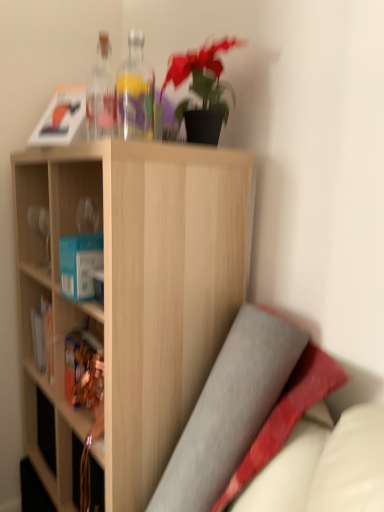
Question: From a real-world perspective, is transparent glass bottles at upper center, which is counted as the first bottle, starting from the left, positioned under light wood shelf at center based on gravity?

Choices:
 (A) yes
 (B) no

Answer: (B)

Question: Is transparent glass bottles at upper center, which is counted as the first bottle, starting from the left, to the left of light wood shelf at center from the viewer's perspective?

Choices:
 (A) no
 (B) yes

Answer: (A)

Question: Does transparent glass bottles at upper center, which is counted as the first bottle, starting from the left, have a larger size compared to light wood shelf at center?

Choices:
 (A) yes
 (B) no

Answer: (B)

Question: Does transparent glass bottles at upper center, the 2th bottle from the right, have a smaller size compared to light wood shelf at center?

Choices:
 (A) yes
 (B) no

Answer: (A)

Question: From the image's perspective, is transparent glass bottles at upper center, which is counted as the first bottle, starting from the left, beneath light wood shelf at center?

Choices:
 (A) yes
 (B) no

Answer: (B)

Question: Is there a large distance between transparent glass bottles at upper center, the 2th bottle from the right, and light wood shelf at center?

Choices:
 (A) yes
 (B) no

Answer: (B)

Question: Is light wood shelf at center surrounded by transparent glass bottle at upper center, positioned as the second bottle in left-to-right order?

Choices:
 (A) yes
 (B) no

Answer: (B)

Question: Is transparent glass bottle at upper center, placed as the first bottle when sorted from right to left, wider than light wood shelf at center?

Choices:
 (A) yes
 (B) no

Answer: (B)

Question: Is transparent glass bottle at upper center, positioned as the second bottle in left-to-right order, not within light wood shelf at center?

Choices:
 (A) yes
 (B) no

Answer: (A)

Question: Considering the relative positions of transparent glass bottle at upper center, placed as the first bottle when sorted from right to left, and light wood shelf at center in the image provided, is transparent glass bottle at upper center, placed as the first bottle when sorted from right to left, behind light wood shelf at center?

Choices:
 (A) yes
 (B) no

Answer: (A)

Question: Does transparent glass bottle at upper center, positioned as the second bottle in left-to-right order, come in front of light wood shelf at center?

Choices:
 (A) yes
 (B) no

Answer: (B)

Question: Is transparent glass bottle at upper center, placed as the first bottle when sorted from right to left, looking in the opposite direction of light wood shelf at center?

Choices:
 (A) no
 (B) yes

Answer: (A)

Question: Is transparent glass bottle at upper center, placed as the first bottle when sorted from right to left, shorter than matte brown book at left?

Choices:
 (A) no
 (B) yes

Answer: (A)